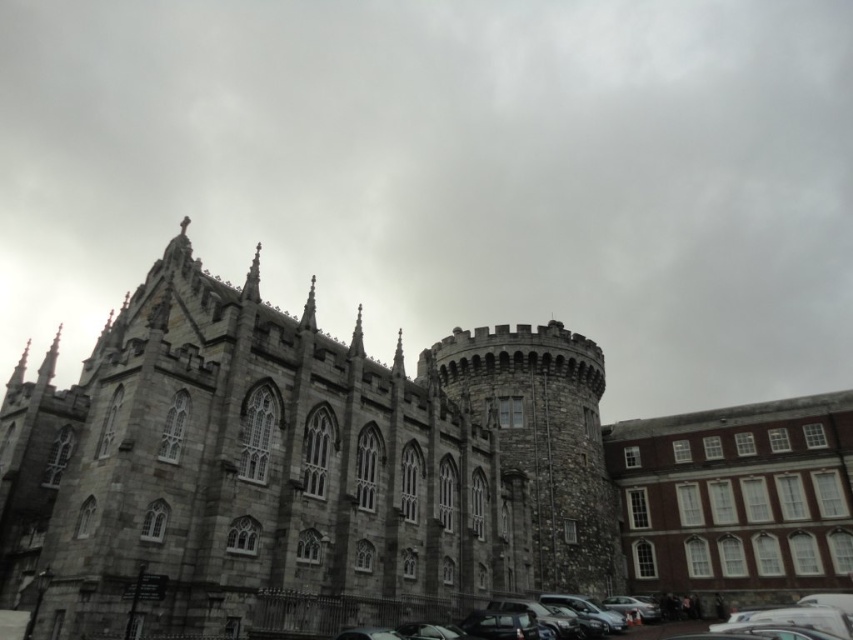
Question: Among these points, which one is farthest from the camera?

Choices:
 (A) (810, 621)
 (B) (358, 557)

Answer: (B)

Question: Where is gray stone castle at center located in relation to shiny black car at lower center in the image?

Choices:
 (A) below
 (B) above

Answer: (B)

Question: Where is gray stone castle at center located in relation to shiny black car at lower center in the image?

Choices:
 (A) below
 (B) above

Answer: (B)

Question: Does gray stone castle at center come in front of shiny black car at lower center?

Choices:
 (A) yes
 (B) no

Answer: (A)

Question: Which object is closer to the camera taking this photo?

Choices:
 (A) gray stone castle at center
 (B) shiny black car at lower center

Answer: (A)